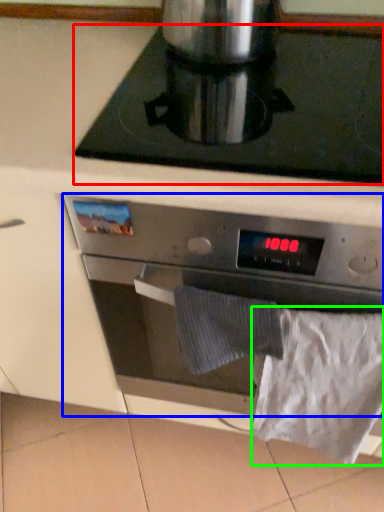
Question: Based on their relative distances, which object is nearer to gas stove (highlighted by a red box)? Choose from kitchen appliance (highlighted by a blue box) and sheet (highlighted by a green box).

Choices:
 (A) kitchen appliance
 (B) sheet

Answer: (A)